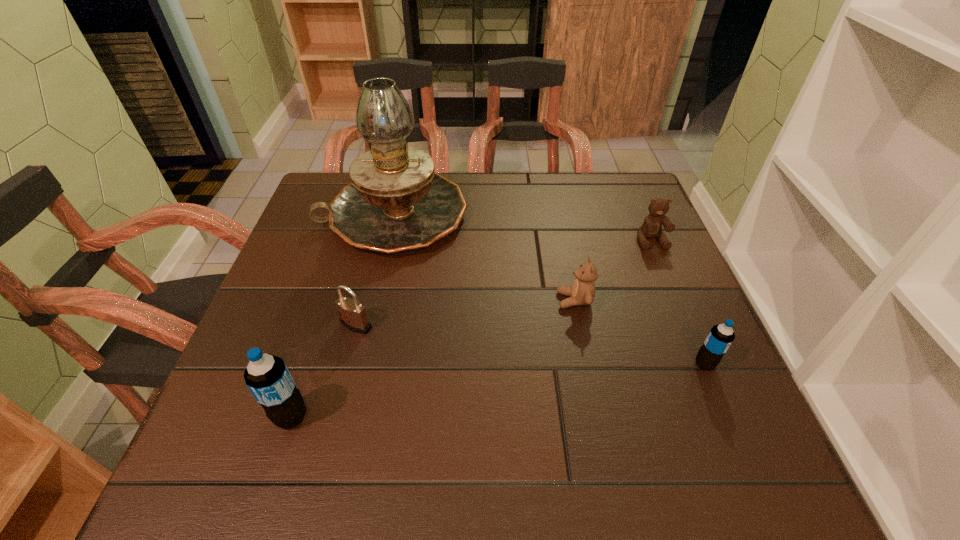
You are a GUI agent. You are given a task and a screenshot of the screen. Output one action in this format:
    pyautogui.click(x=<x>, y=<y>)
    Task: Click on the nearest object
    The width and height of the screenshot is (960, 540).
    Given the screenshot: What is the action you would take?
    pyautogui.click(x=267, y=377)

This screenshot has width=960, height=540. What are the coordinates of `the second tallest object` in the screenshot? It's located at (x=267, y=377).

The image size is (960, 540). I want to click on the right soda bottle, so click(721, 336).

Identify the location of the second nearest object. This screenshot has width=960, height=540. (721, 336).

I want to click on the tallest object, so click(396, 202).

Identify the location of the nearer teddy bear. This screenshot has height=540, width=960. (582, 292).

Where is `the left teddy bear`? The width and height of the screenshot is (960, 540). the left teddy bear is located at coordinates (582, 292).

This screenshot has width=960, height=540. Identify the location of padlock. [x=353, y=316].

I want to click on the farther teddy bear, so click(x=652, y=227).

Identify the location of free space located on the back of the left soda bottle. (335, 284).